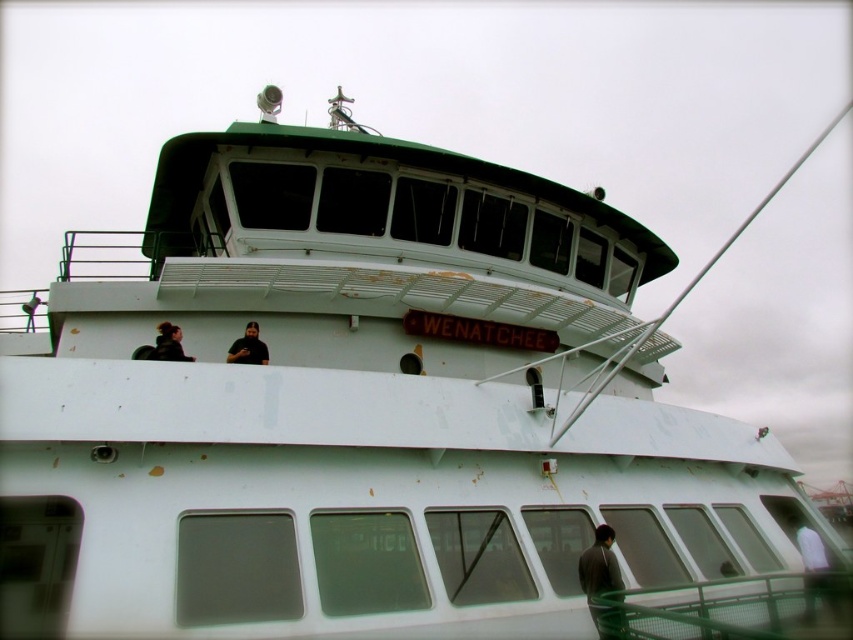
You are on the upper deck of the ferry Wenatchee. You see two points marked on the deck. The first point is at coordinate point (579, 586) and the second is at point (177, 332). If you are facing the front of the ferry, which point is closer to the front?

Point (579, 586) is in front of point (177, 332), so if you are facing the front of the ferry, the point (579, 586) is closer to the front.

You are a passenger on the ferry Wenatchee and want to take a photo of both the dark gray sweater at lower right and the black matte shirt at upper center. Which one should you focus on first to ensure both are in focus?

You should focus on the dark gray sweater at lower right first because it is closer to you than the black matte shirt at upper center, so adjusting focus from near to far will help both be in focus.